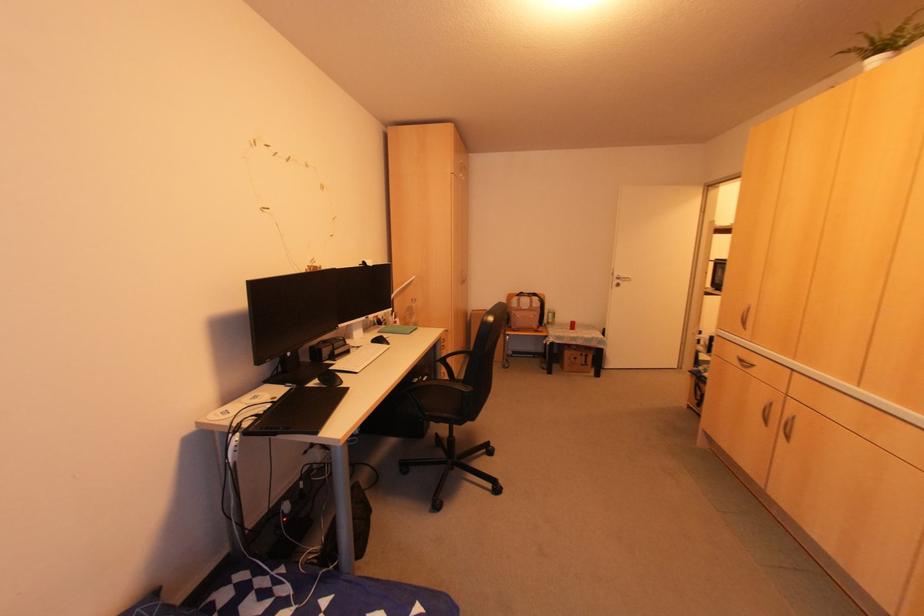
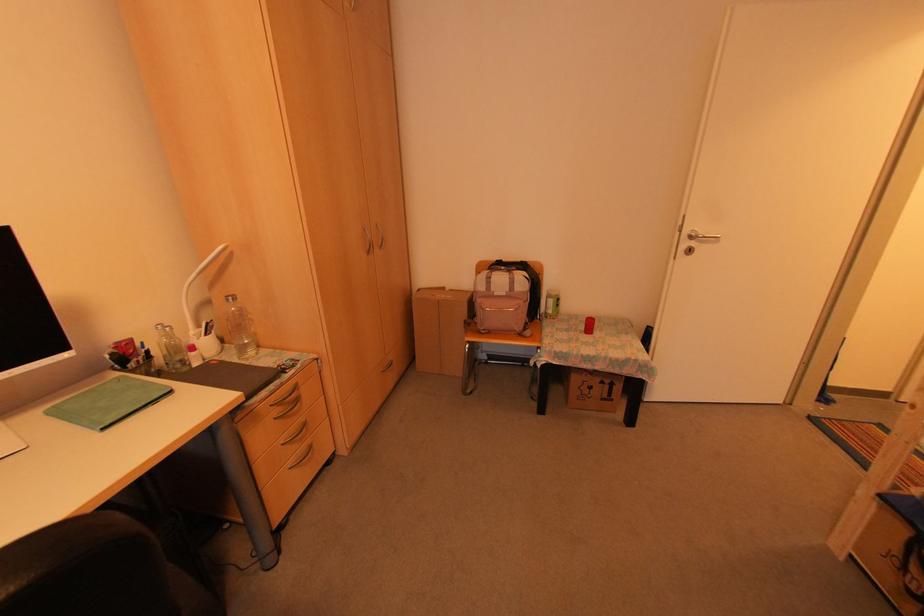
Find the pixel in the second image that matches (x=459, y=283) in the first image.

(366, 249)